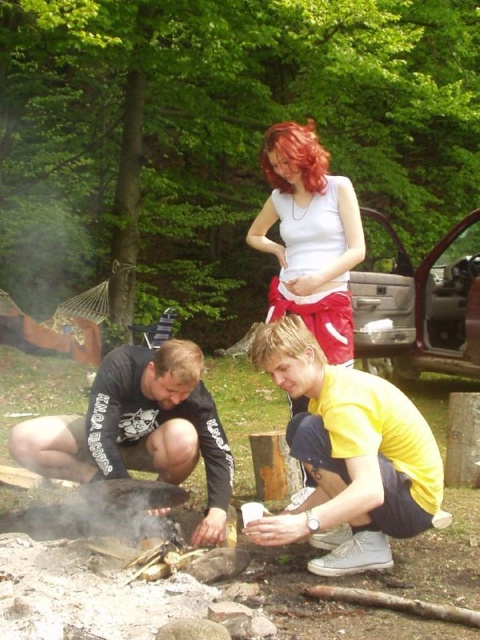
Can you confirm if yellow matte shirt at lower center is positioned to the left of white matte tank top at center?

No, yellow matte shirt at lower center is not to the left of white matte tank top at center.

Is yellow matte shirt at lower center smaller than white matte tank top at center?

Actually, yellow matte shirt at lower center might be larger than white matte tank top at center.

What do you see at coordinates (348, 458) in the screenshot? The image size is (480, 640). I see `yellow matte shirt at lower center` at bounding box center [348, 458].

Locate an element on the screen. Image resolution: width=480 pixels, height=640 pixels. yellow matte shirt at lower center is located at coordinates (348, 458).

Between yellow matte shirt at lower center and black cotton shirt at center, which one has more height?

yellow matte shirt at lower center

Is yellow matte shirt at lower center behind black cotton shirt at center?

No, yellow matte shirt at lower center is closer to the viewer.

Who is more distant from viewer, (384,538) or (203,529)?

The point (203,529) is behind.

What are the coordinates of `yellow matte shirt at lower center` in the screenshot? It's located at (348, 458).

Can you confirm if black cotton shirt at center is bigger than white matte tank top at center?

Yes, black cotton shirt at center is bigger than white matte tank top at center.

Who is more forward, (170,442) or (328,250)?

Point (170,442)

Image resolution: width=480 pixels, height=640 pixels. I want to click on black cotton shirt at center, so click(x=139, y=428).